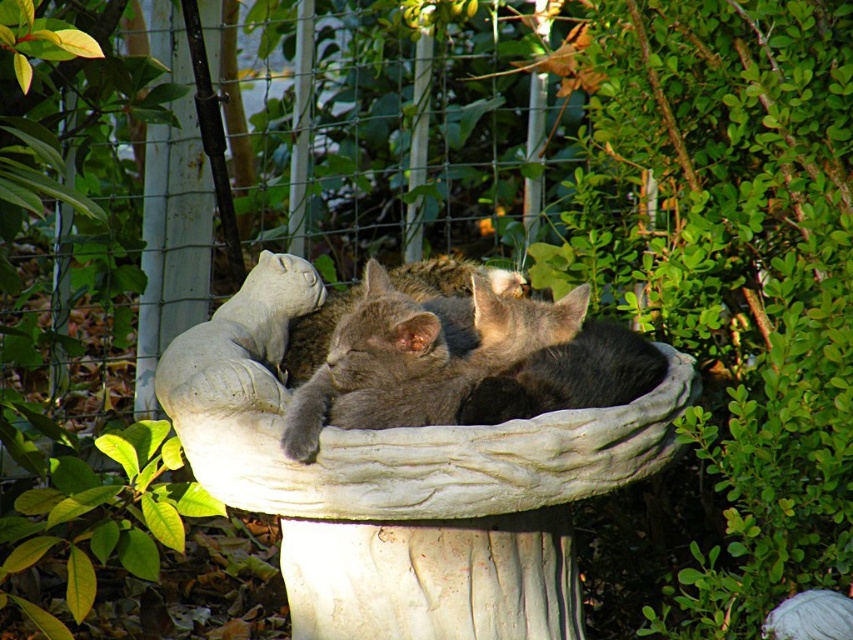
You are a small cat trying to jump from the metallic wire fence at upper center to the white stone bowl at center. Can you make the jump if your maximum jump distance is 70 centimeters?

The metallic wire fence at upper center is 75.70 centimeters away from the white stone bowl at center, which is beyond the cat s maximum jump distance of 70 centimeters. Therefore, the cat cannot make the jump.

You are a cat owner who wants to place a new cat toy on the white stone bowl at center so that your gray soft fur cat at center can see it. Where should you place the toy?

The white stone bowl at center is closer to you than the gray soft fur cat at center. To ensure the cat can see the toy, place it on the edge of the white stone bowl at center facing towards the cat.